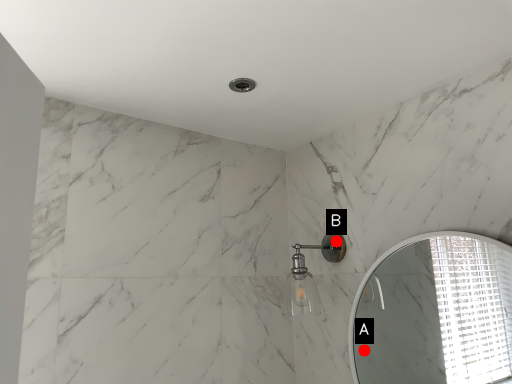
Question: Two points are circled on the image, labeled by A and B beside each circle. Among these points, which one is nearest to the camera?

Choices:
 (A) A is closer
 (B) B is closer

Answer: (B)